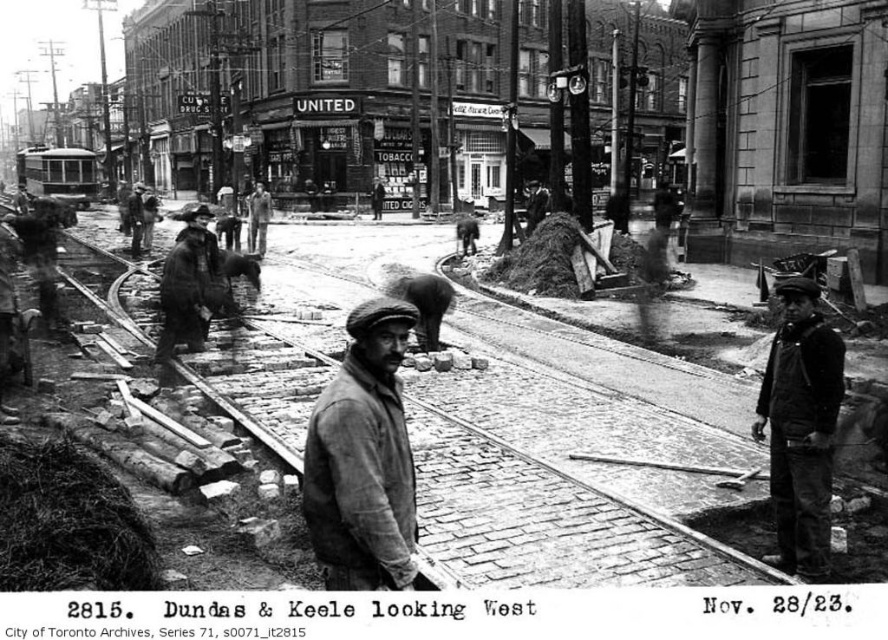
Who is lower down, dark gray fabric jacket at center or rugged brown coat at center?

dark gray fabric jacket at center

Between dark gray fabric jacket at center and rugged brown coat at center, which one has more height?

With more height is rugged brown coat at center.

What do you see at coordinates (799, 426) in the screenshot?
I see `dark gray fabric jacket at center` at bounding box center [799, 426].

The image size is (888, 640). I want to click on dark gray fabric jacket at center, so pyautogui.click(x=799, y=426).

Measure the distance between smooth wooden planks at center and dark gray fabric jacket at center.

The distance of smooth wooden planks at center from dark gray fabric jacket at center is 7.39 meters.

This screenshot has width=888, height=640. Find the location of `smooth wooden planks at center`. smooth wooden planks at center is located at coordinates (561, 480).

Where is `smooth wooden planks at center`? smooth wooden planks at center is located at coordinates (561, 480).

Image resolution: width=888 pixels, height=640 pixels. What do you see at coordinates (363, 458) in the screenshot?
I see `worn brown jacket at center` at bounding box center [363, 458].

From the picture: Does worn brown jacket at center have a greater width compared to coarse woolen coat at center-left?

Incorrect, worn brown jacket at center's width does not surpass coarse woolen coat at center-left's.

Identify the location of worn brown jacket at center. This screenshot has height=640, width=888. (363, 458).